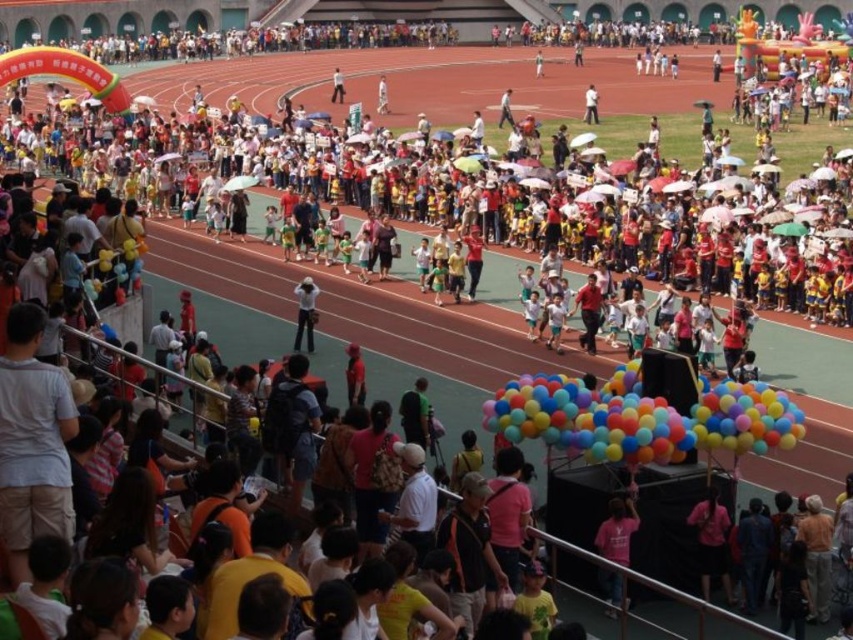
Based on the photo, you are a photographer standing at the center of the running track. You want to take a photo that includes both the pink fabric shirt at lower right and the pink matte shirt at center. Given that your camera has a maximum zoom range that allows capturing objects up to 4 meters apart, will you be able to include both subjects in the same frame without moving?

The pink fabric shirt at lower right and the pink matte shirt at center are 4.09 meters apart. Since the camera can only capture up to 4 meters, the distance is slightly beyond the maximum range. Therefore, you will not be able to include both subjects in the same frame without moving closer or adjusting your position.

You are a photographer positioned at the back of the crowd. You want to take a photo of the multicolored balloons at center and the pink fabric shirt at lower right. Which object will appear taller in the photo?

The pink fabric shirt at lower right will appear taller in the photo because the multicolored balloons at center has a lesser height compared to pink fabric shirt at lower right.